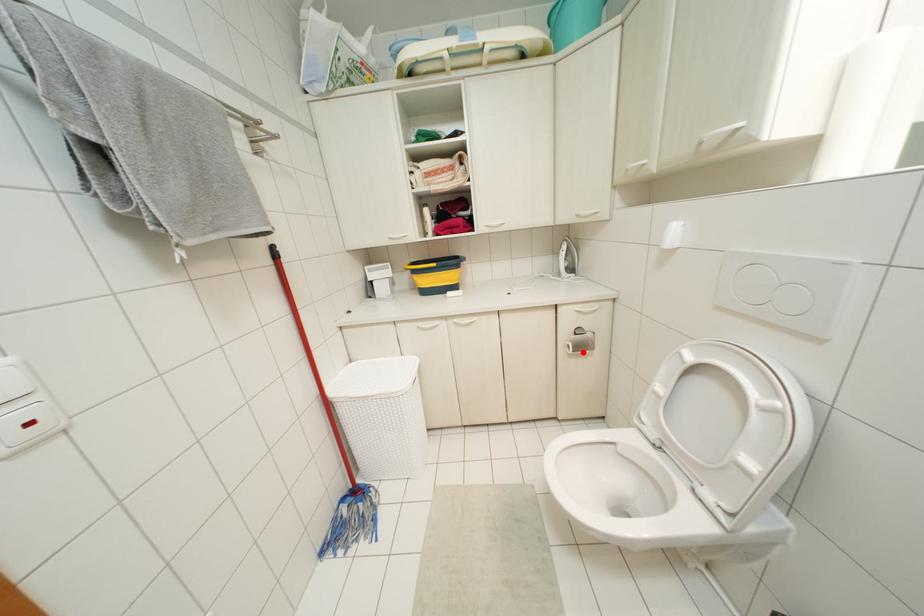
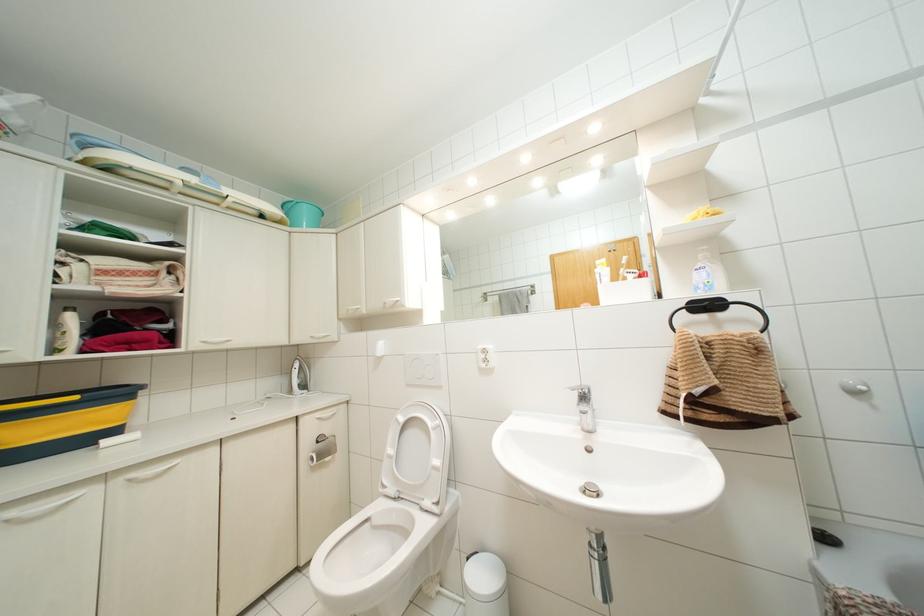
Find the pixel in the second image that matches the highlighted location in the first image.

(326, 459)